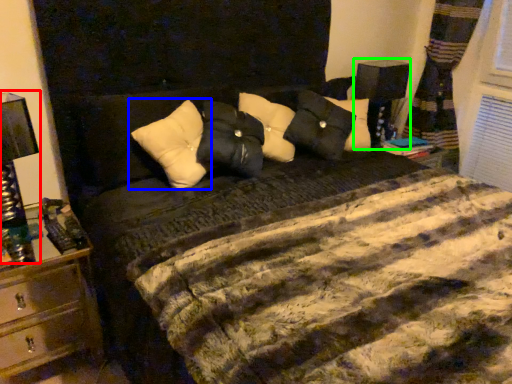
Question: Based on their relative distances, which object is farther from bedside lamp (highlighted by a red box)? Choose from pillow (highlighted by a blue box) and bedside lamp (highlighted by a green box).

Choices:
 (A) pillow
 (B) bedside lamp

Answer: (B)